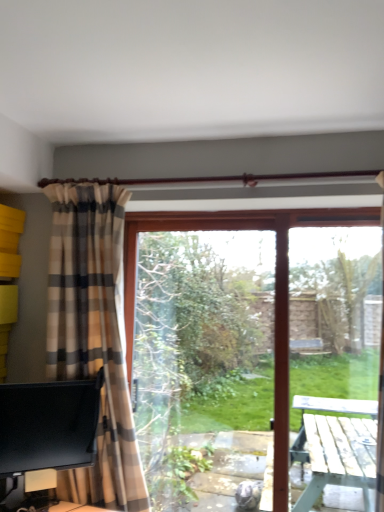
Question: From a real-world perspective, relative to black glossy monitor at lower left, is transparent glass window screen at center vertically above or below?

Choices:
 (A) above
 (B) below

Answer: (A)

Question: Would you say transparent glass window screen at center is to the left or to the right of black glossy monitor at lower left in the picture?

Choices:
 (A) right
 (B) left

Answer: (A)

Question: Considering the real-world distances, which object is farthest from the transparent glass screen door at right?

Choices:
 (A) black glossy monitor at lower left
 (B) plaid fabric curtain at left
 (C) transparent glass window screen at center

Answer: (A)

Question: Which object is positioned farthest from the transparent glass window screen at center?

Choices:
 (A) black glossy monitor at lower left
 (B) transparent glass screen door at right
 (C) plaid fabric curtain at left

Answer: (B)